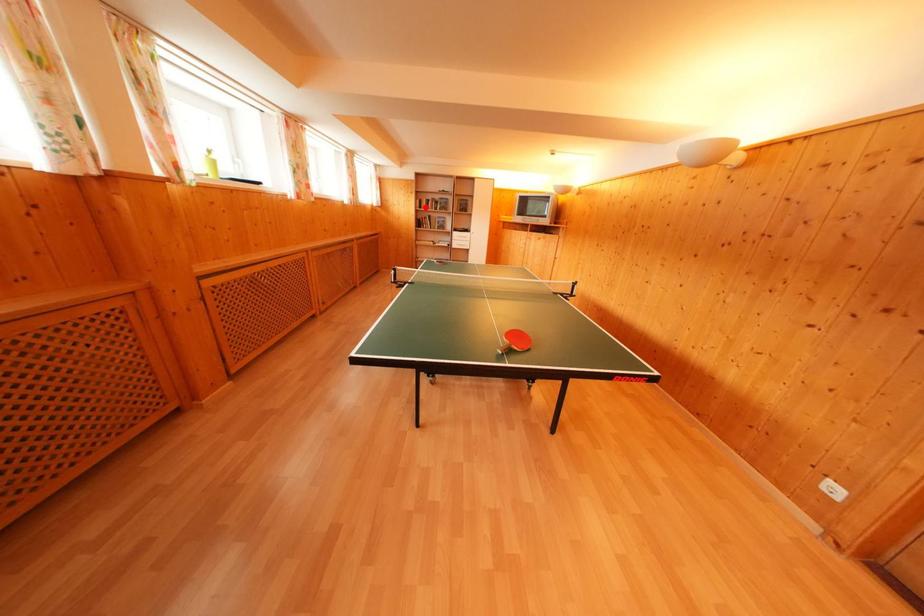
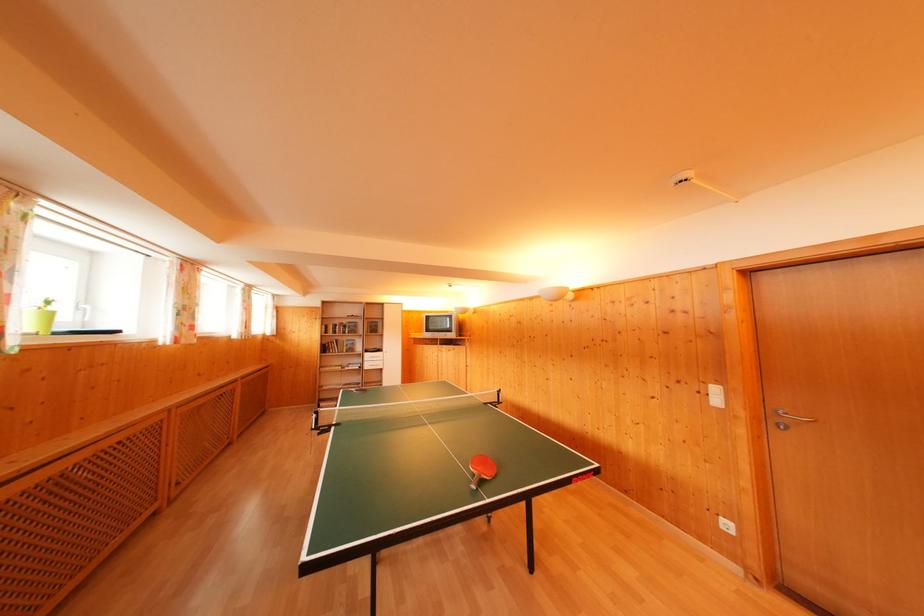
The point at the highlighted location is marked in the first image. Where is the corresponding point in the second image?

(331, 333)